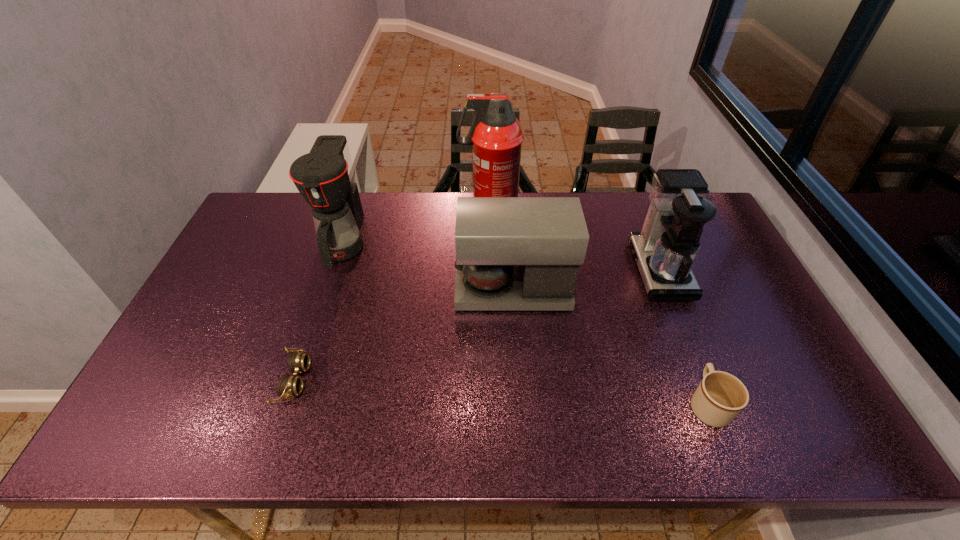
This screenshot has height=540, width=960. In order to click on unoccupied position between the leftmost coffee maker and the second shortest object in this screenshot , I will do `click(525, 324)`.

Where is `empty space that is in between the shortest object and the rightmost coffee maker`? empty space that is in between the shortest object and the rightmost coffee maker is located at coordinates (476, 325).

I want to click on free point between the rightmost coffee maker and the goggles, so click(476, 325).

I want to click on free space between the second coffee maker from right to left and the leftmost coffee maker, so click(428, 267).

Find the location of a particular element. free space between the rightmost coffee maker and the second coffee maker from left to right is located at coordinates (587, 280).

Select which object appears as the closest to the second coffee maker from right to left. Please provide its 2D coordinates. Your answer should be formatted as a tuple, i.e. [(x, y)], where the tuple contains the x and y coordinates of a point satisfying the conditions above.

[(666, 249)]

Select which object is the third closest to the leftmost coffee maker. Please provide its 2D coordinates. Your answer should be formatted as a tuple, i.e. [(x, y)], where the tuple contains the x and y coordinates of a point satisfying the conditions above.

[(512, 253)]

Choose which coffee maker is the nearest neighbor to the rightmost coffee maker. Please provide its 2D coordinates. Your answer should be formatted as a tuple, i.e. [(x, y)], where the tuple contains the x and y coordinates of a point satisfying the conditions above.

[(512, 253)]

Locate which coffee maker is the closest to the second coffee maker from right to left. Please provide its 2D coordinates. Your answer should be formatted as a tuple, i.e. [(x, y)], where the tuple contains the x and y coordinates of a point satisfying the conditions above.

[(666, 249)]

Locate an element on the screen. vacant space that satisfies the following two spatial constraints: 1. on the side of the mug with the handle; 2. on the trigger side of the fire extinguisher is located at coordinates (632, 210).